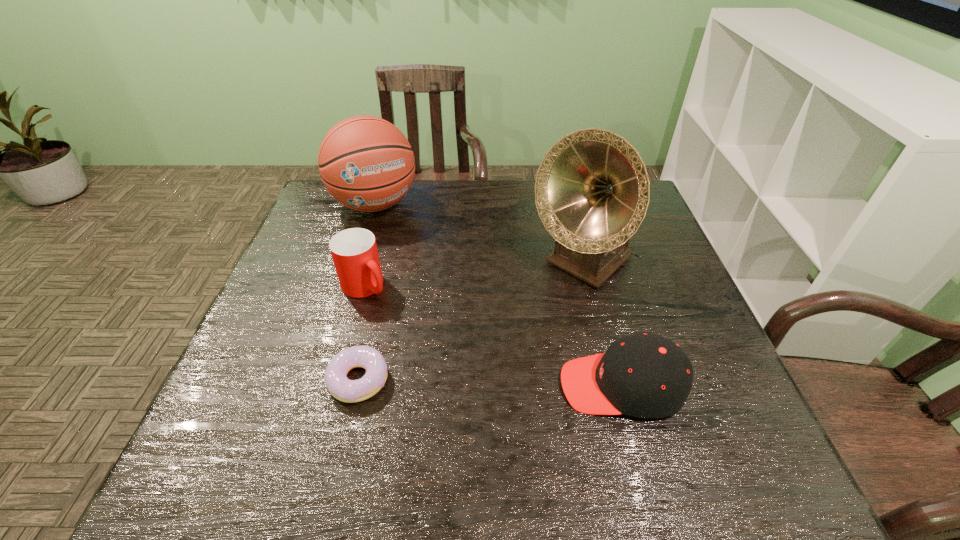
The image size is (960, 540). I want to click on vacant space on the desktop that is between the doughnut and the second shortest object and is positioned on the horn of the tallest object, so click(x=450, y=382).

The width and height of the screenshot is (960, 540). Find the location of `free space on the desktop that is between the shortest object and the second shortest object and is positioned on the side of the cup with the handle`. free space on the desktop that is between the shortest object and the second shortest object and is positioned on the side of the cup with the handle is located at coordinates (472, 382).

The width and height of the screenshot is (960, 540). What are the coordinates of `vacant space on the desktop that is between the shortest object and the cap and is positioned on the logo side of the second tallest object` in the screenshot? It's located at pyautogui.click(x=454, y=382).